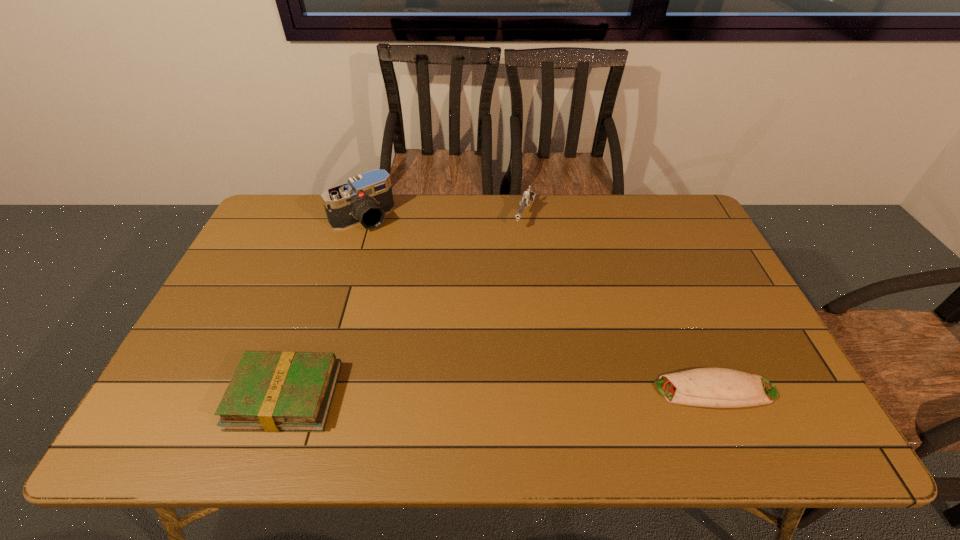
Identify the location of blank region between the camera and the burrito. Image resolution: width=960 pixels, height=540 pixels. (539, 304).

The image size is (960, 540). Find the location of `free point between the tallest object and the book`. free point between the tallest object and the book is located at coordinates (324, 307).

Where is `unoccupied position between the tallest object and the third shortest object`? Image resolution: width=960 pixels, height=540 pixels. unoccupied position between the tallest object and the third shortest object is located at coordinates 444,216.

I want to click on free area in between the rightmost object and the tallest object, so click(539, 304).

Identify the location of blank region between the shortest object and the book. This screenshot has height=540, width=960. (500, 393).

Locate an element on the screen. vacant area that lies between the tallest object and the third tallest object is located at coordinates (324, 307).

Identify the location of object that stands as the second closest to the gun. (704, 387).

Identify which object is the third closest to the third shortest object. Please provide its 2D coordinates. Your answer should be formatted as a tuple, i.e. [(x, y)], where the tuple contains the x and y coordinates of a point satisfying the conditions above.

[(288, 391)]

Where is `free space that satisfies the following two spatial constraints: 1. on the back side of the burrito; 2. at the bitten end of the book`? free space that satisfies the following two spatial constraints: 1. on the back side of the burrito; 2. at the bitten end of the book is located at coordinates (287, 390).